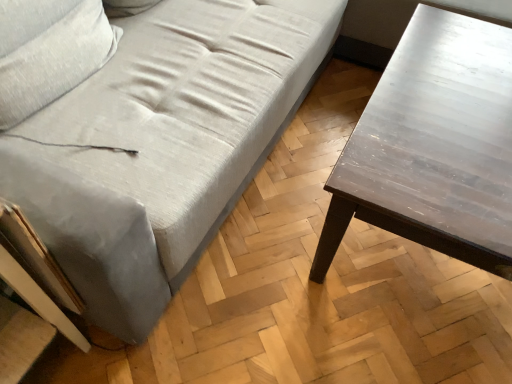
Question: Is point (2, 157) closer or farther from the camera than point (435, 170)?

Choices:
 (A) closer
 (B) farther

Answer: (A)

Question: In the image, is light gray fabric couch at center positioned in front of or behind dark brown wooden table at right?

Choices:
 (A) behind
 (B) front

Answer: (B)

Question: From the image's perspective, is light gray fabric couch at center above or below dark brown wooden table at right?

Choices:
 (A) above
 (B) below

Answer: (A)

Question: From the image's perspective, relative to light gray fabric couch at center, is dark brown wooden table at right above or below?

Choices:
 (A) above
 (B) below

Answer: (B)

Question: In terms of size, does dark brown wooden table at right appear bigger or smaller than light gray fabric couch at center?

Choices:
 (A) big
 (B) small

Answer: (B)

Question: From a real-world perspective, is dark brown wooden table at right physically located above or below light gray fabric couch at center?

Choices:
 (A) above
 (B) below

Answer: (B)

Question: Is point (355, 206) positioned closer to the camera than point (323, 14)?

Choices:
 (A) farther
 (B) closer

Answer: (B)